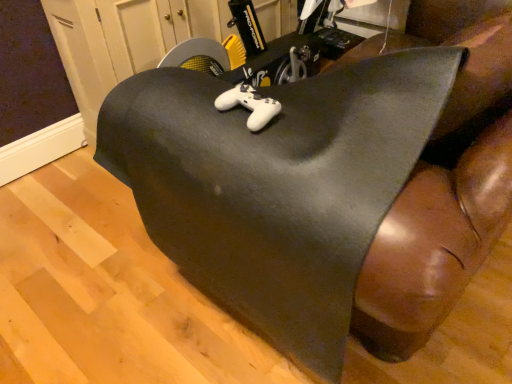
This screenshot has height=384, width=512. What do you see at coordinates (249, 105) in the screenshot?
I see `white matte controller at center` at bounding box center [249, 105].

What are the coordinates of `white matte controller at center` in the screenshot? It's located at (249, 105).

I want to click on white matte controller at center, so click(249, 105).